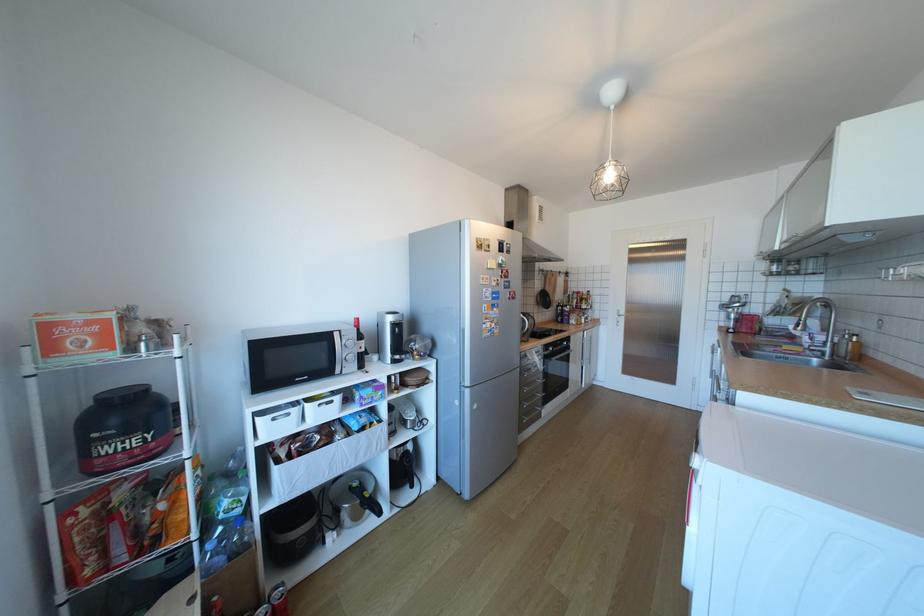
Describe the element at coordinates (329, 406) in the screenshot. Image resolution: width=924 pixels, height=616 pixels. I see `a white bin handle` at that location.